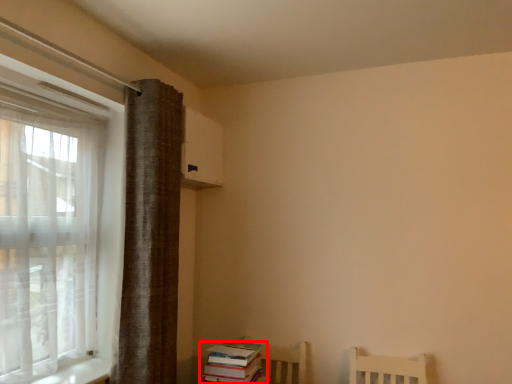
Question: Where is book (annotated by the red box) located in relation to curtain in the image?

Choices:
 (A) left
 (B) right

Answer: (B)